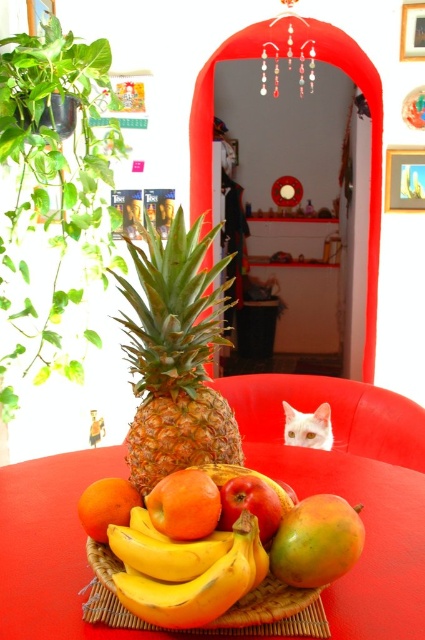
Question: Can you confirm if yellow/golden/skinny pineapple at center is positioned to the right of orange matte at center?

Choices:
 (A) yes
 (B) no

Answer: (B)

Question: Which point is closer to the camera?

Choices:
 (A) (323, 544)
 (B) (331, 620)
 (C) (164, 529)
 (D) (2, 362)

Answer: (A)

Question: Which of the following is the farthest from the observer?

Choices:
 (A) mango at center
 (B) green leafy plant at left
 (C) wooden basket of fruit at center
 (D) yellow/golden/skinny pineapple at center

Answer: (B)

Question: Which point is farther from the camera taking this photo?

Choices:
 (A) (172, 604)
 (B) (333, 566)

Answer: (B)

Question: In this image, where is white fabric armchair at lower right located relative to mango at center?

Choices:
 (A) below
 (B) above

Answer: (A)

Question: Is green leafy plant at left thinner than white fabric armchair at lower right?

Choices:
 (A) no
 (B) yes

Answer: (B)